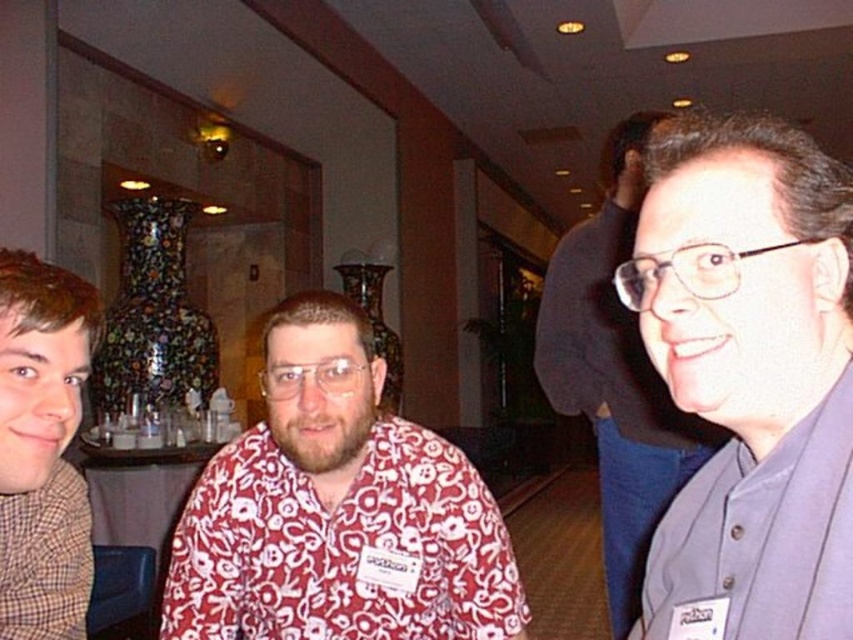
You are organizing a photo shoot and need to arrange the blue cotton shirt at right and the brown checkered scarf at left in a way that maintains their original positions but ensures the shorter item is placed lower in the frame. Is this arrangement possible based on their current heights?

The blue cotton shirt at right is shorter than the brown checkered scarf at left. To place the shorter item lower, you can adjust their vertical positions so the blue cotton shirt at right is positioned lower in the frame than the brown checkered scarf at left, maintaining their original left and right placements.